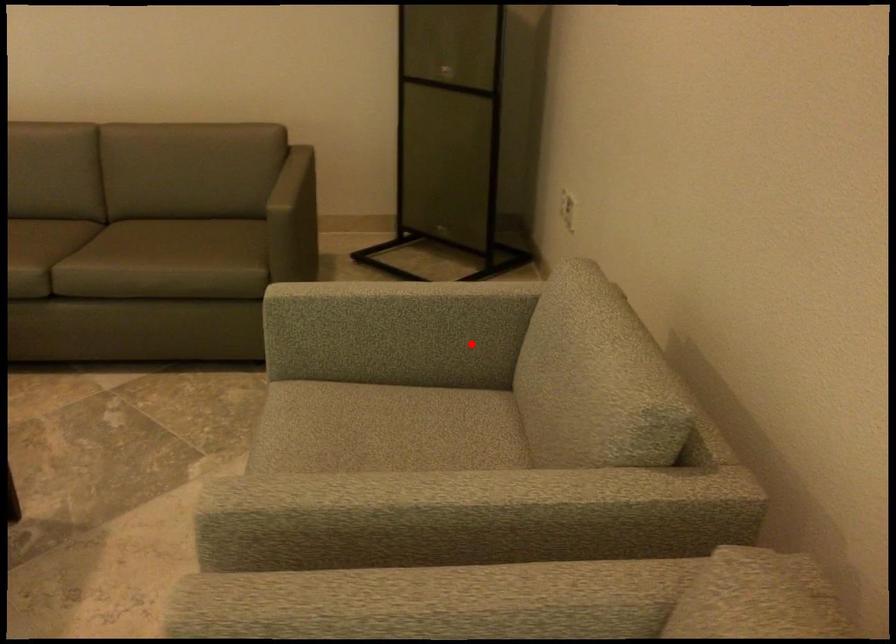
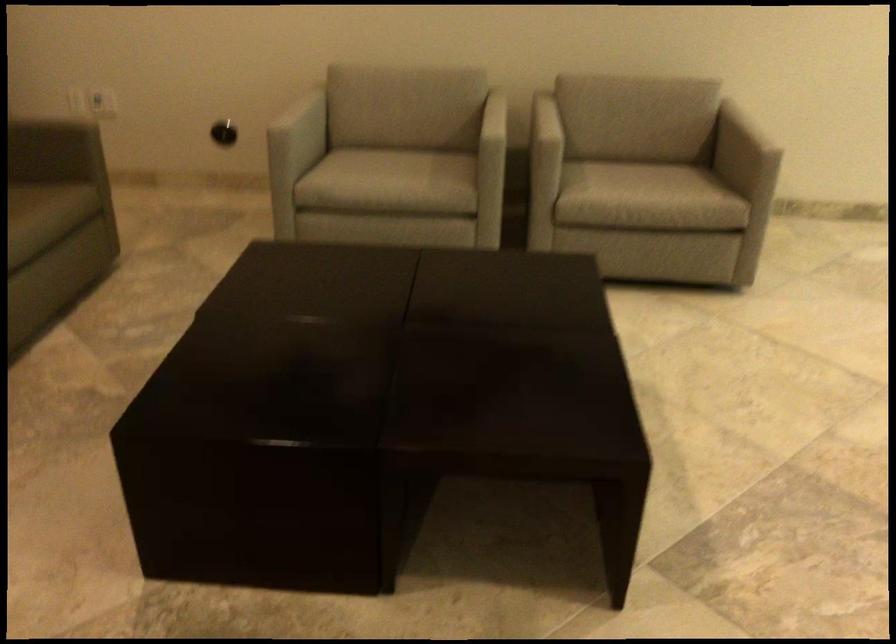
Question: I am providing you with two images of the same scene from different viewpoints. Given a red point in image1, look at the same physical point in image2. Is it:

Choices:
 (A) Closer to the viewpoint
 (B) Farther from the viewpoint

Answer: (B)